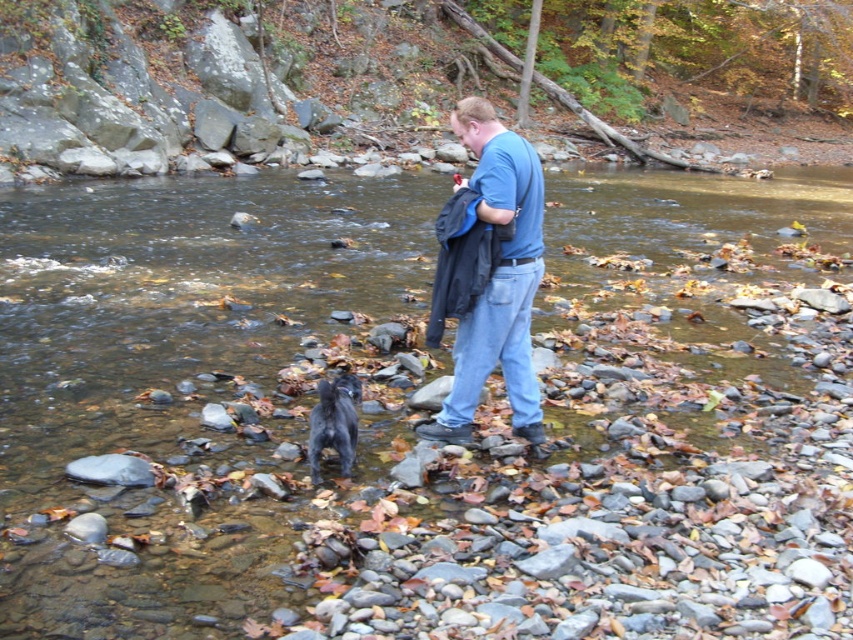
You are navigating a shallow river and need to cross to the other side. You see a smooth rock creek at center. Based on its position, can you step on it to cross?

The smooth rock creek at center is located at point (421, 413), which is within the navigable area of the river. Yes, you can step on it to cross safely.

You are a hiker who needs to place a 10 feet long tent between the smooth rock creek at center and the blue cotton shirt at center. Is there enough space between them to set up the tent?

The distance between the smooth rock creek at center and the blue cotton shirt at center is 14.41 feet, which is longer than the 10 feet required for the tent. Therefore, there is enough space to set up the tent between them.